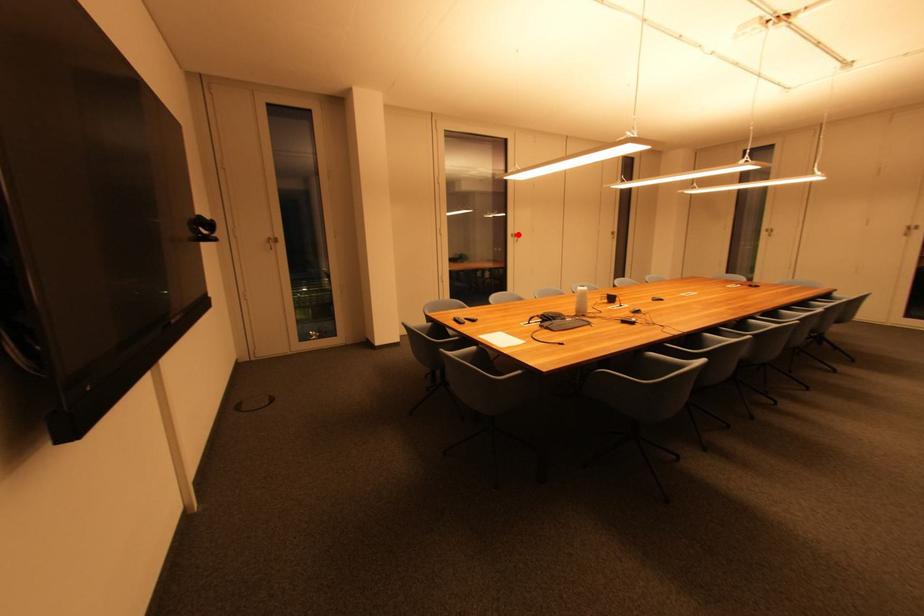
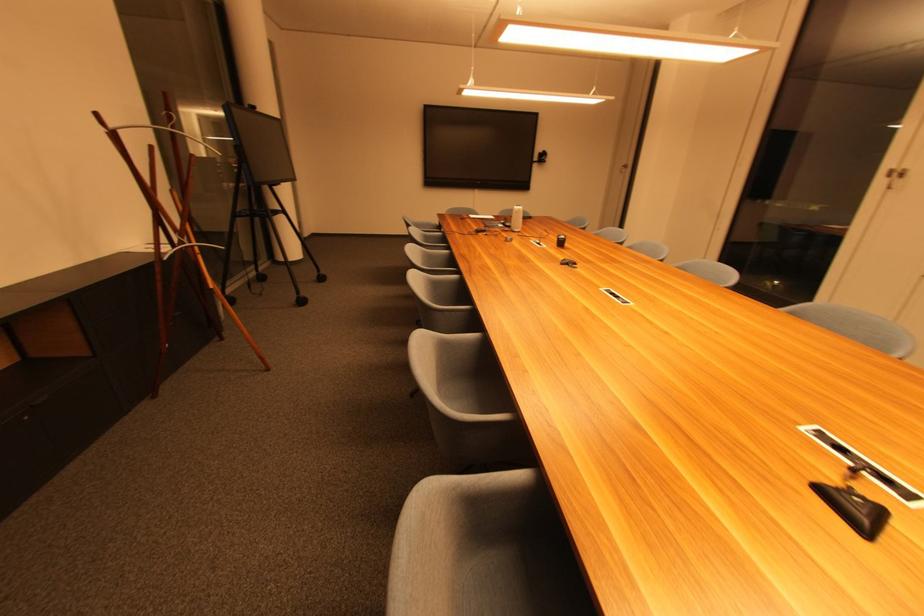
The point at the highlighted location is marked in the first image. Where is the corresponding point in the second image?

(901, 169)